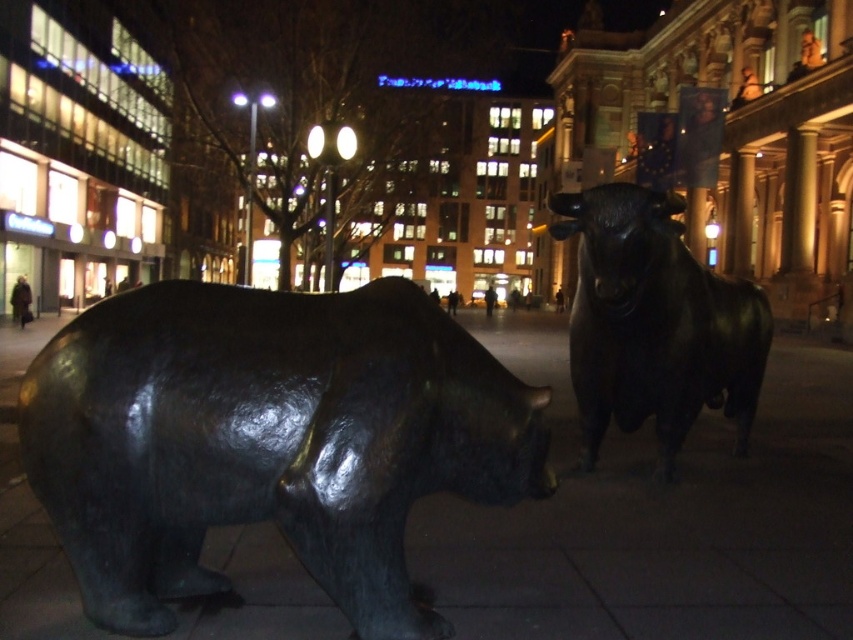
You are standing at the center of the image and want to move towards the shiny bronze bear at left. Which direction should you move?

Since the shiny bronze bear at left is located at point (267, 440), you should move towards the left side of the image to reach it.

You are a delivery person trying to navigate through the area between the shiny bronze bear at left and the shiny black bull at center. The delivery cart is 1.2 meters wide. Can you pass through this space without touching either sculpture?

The shiny bronze bear at left might be wider than shiny black bull at center, so the space between them could be narrower than 1.2 meters. There is a risk of the cart touching the sculptures if the distance is insufficient.

You are standing at the center of the street in front of the two bulls. Which bull is closer to the point marked at coordinates (x=267, y=440)?

The point marked at coordinates (x=267, y=440) is closer to the shiny bronze bear at left.